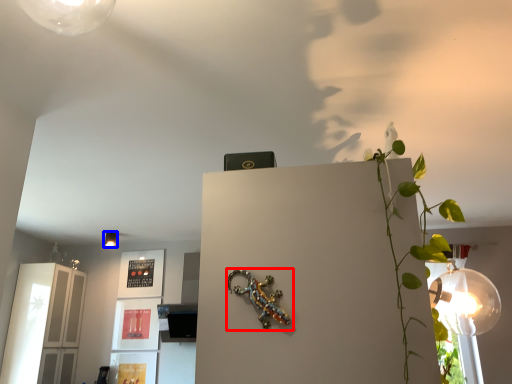
Question: Which point is closer to the camera, lizard (highlighted by a red box) or lamp (highlighted by a blue box)?

Choices:
 (A) lizard
 (B) lamp

Answer: (A)